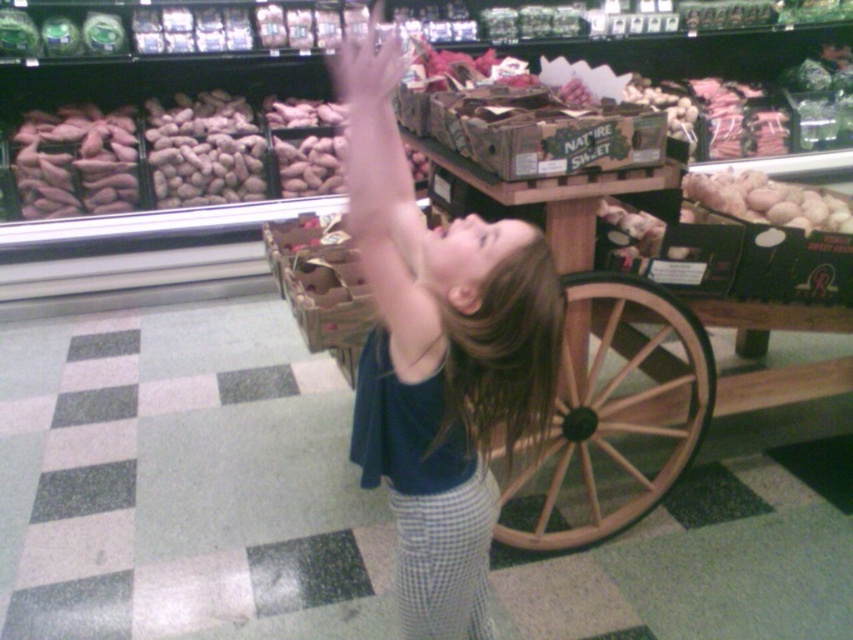
You are standing at the point labeled point (x=366, y=60) in the grocery store produce section. You want to walk to the point labeled point (x=741, y=189). Which direction should you move relative to your current position?

You should move backward to reach point (x=741, y=189) because it is located behind point (x=366, y=60).

You are a grocery store employee who needs to reach the smooth brown peanuts at upper left. You notice a customer has their smooth skin hand at upper center blocking your path. Can you easily access the peanuts without moving the customer?

The smooth brown peanuts at upper left are closer to the viewer than the smooth skin hand at upper center, meaning the peanuts are in front of the hand. Therefore, you can easily access the peanuts without needing to move the customer.

You are a store employee who needs to restock the peanuts. You see the smooth brown peanuts at upper left and the smooth skin hand at upper center. Which object is positioned to the left of the other?

The smooth brown peanuts at upper left are positioned to the left of the smooth skin hand at upper center.